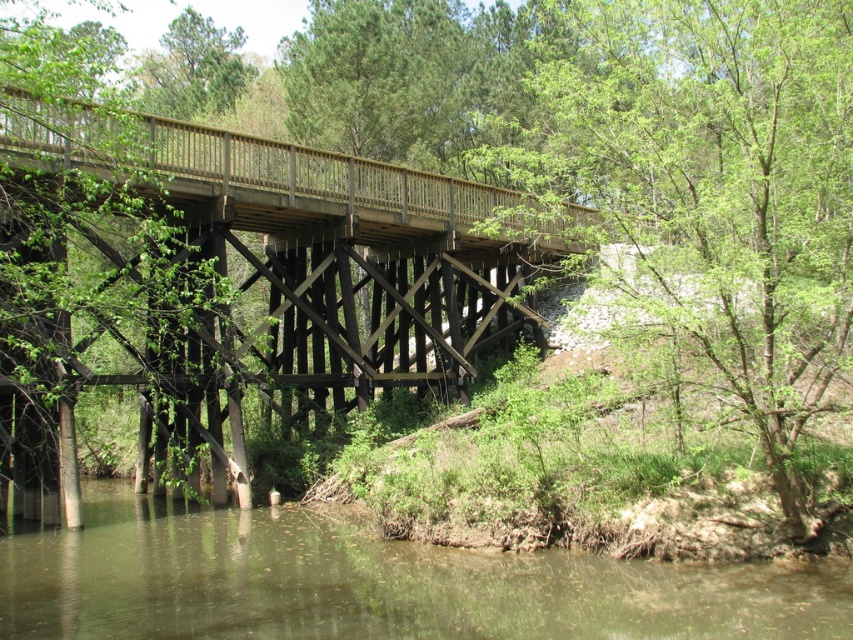
Consider the image. You are standing on the rustic wooden bridge and want to move from the point at coordinates point (549,136) to the point at coordinates point (97,481). Which direction should you move relative to the bridge?

You should move towards the front of the bridge because point (549,136) is behind point (97,481).